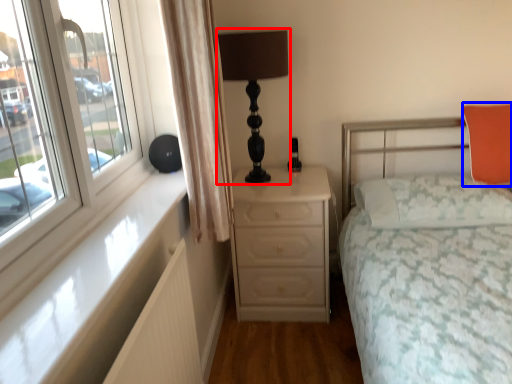
Question: Which of the following is the closest to the observer, table lamp (highlighted by a red box) or pillow (highlighted by a blue box)?

Choices:
 (A) table lamp
 (B) pillow

Answer: (A)